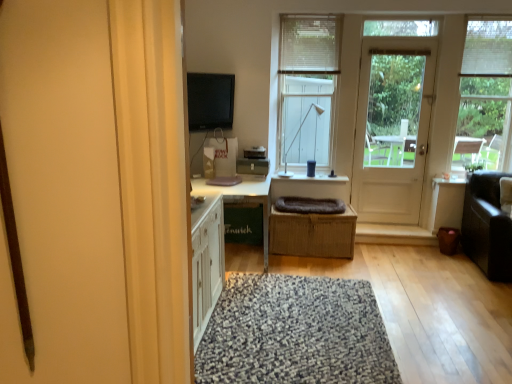
Where is `empty space that is ontop of woven brown basket at center (from a real-world perspective)`? Image resolution: width=512 pixels, height=384 pixels. empty space that is ontop of woven brown basket at center (from a real-world perspective) is located at coordinates (312, 210).